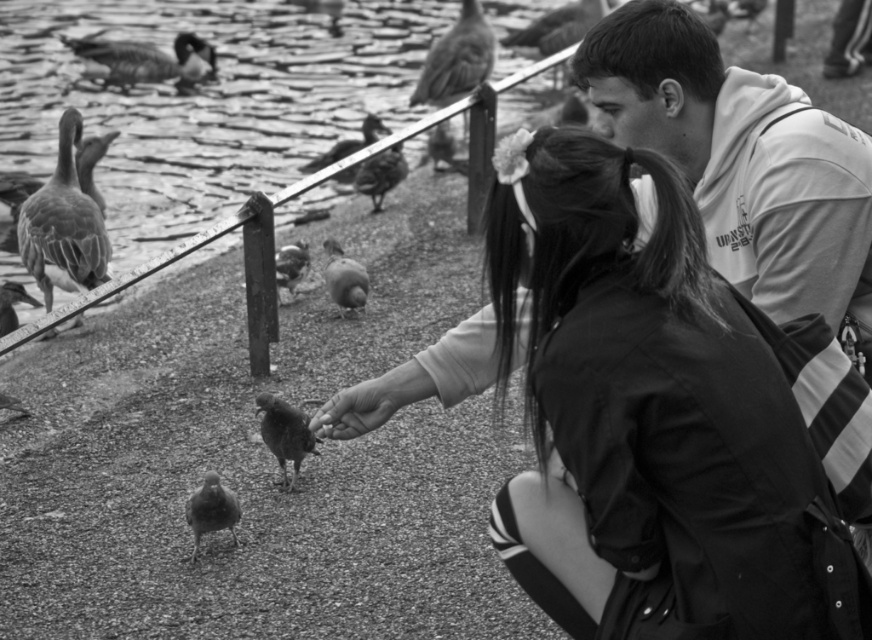
You are a photographer trying to capture a closeup of both the smooth feathered pigeon at center and the smooth feathered bird at center. Since you can only focus on one at a time, which one should you choose to ensure the other is still in the frame?

The smooth feathered pigeon at center is positioned on the right side of the smooth feathered bird at center. Therefore, focusing on the smooth feathered bird at center would keep the pigeon on its right side within the frame, while focusing on the pigeon might risk the bird being out of frame if the camera adjusts the composition.